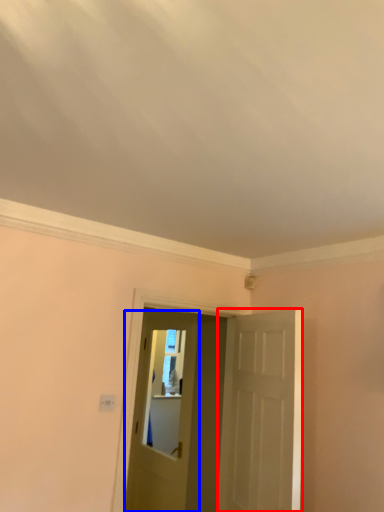
Question: Which of the following is the closest to the observer, door (highlighted by a red box) or door (highlighted by a blue box)?

Choices:
 (A) door
 (B) door

Answer: (A)